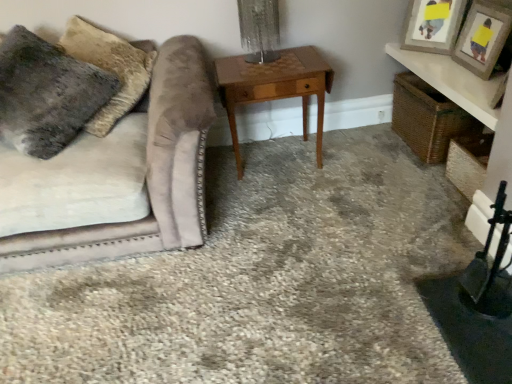
Question: Is wooden picture frame at upper right, placed as the second picture frame when sorted from back to front, closer to camera compared to wooden picture frame at upper right, which ranks as the 2th picture frame in front-to-back order?

Choices:
 (A) yes
 (B) no

Answer: (A)

Question: Is wooden picture frame at upper right, which is the 1th picture frame in front-to-back order, wider than wooden picture frame at upper right, marked as the first picture frame in a back-to-front arrangement?

Choices:
 (A) yes
 (B) no

Answer: (A)

Question: Is wooden picture frame at upper right, which is the 1th picture frame in front-to-back order, thinner than wooden picture frame at upper right, marked as the first picture frame in a back-to-front arrangement?

Choices:
 (A) yes
 (B) no

Answer: (B)

Question: Is wooden picture frame at upper right, placed as the second picture frame when sorted from back to front, with wooden picture frame at upper right, which ranks as the 2th picture frame in front-to-back order?

Choices:
 (A) no
 (B) yes

Answer: (A)

Question: Is wooden picture frame at upper right, marked as the first picture frame in a back-to-front arrangement, completely or partially inside wooden picture frame at upper right, which is the 1th picture frame in front-to-back order?

Choices:
 (A) yes
 (B) no

Answer: (B)

Question: Is wooden picture frame at upper right, which is the 1th picture frame in front-to-back order, taller than wooden picture frame at upper right, marked as the first picture frame in a back-to-front arrangement?

Choices:
 (A) no
 (B) yes

Answer: (B)

Question: Does wooden picture frame at upper right, placed as the second picture frame when sorted from back to front, have a lesser height compared to light brown wood table at center?

Choices:
 (A) no
 (B) yes

Answer: (B)

Question: Can you confirm if wooden picture frame at upper right, which is the 1th picture frame in front-to-back order, is smaller than light brown wood table at center?

Choices:
 (A) no
 (B) yes

Answer: (B)

Question: Does wooden picture frame at upper right, which is the 1th picture frame in front-to-back order, appear on the left side of light brown wood table at center?

Choices:
 (A) no
 (B) yes

Answer: (A)

Question: Is wooden picture frame at upper right, placed as the second picture frame when sorted from back to front, not near light brown wood table at center?

Choices:
 (A) no
 (B) yes

Answer: (A)

Question: Is wooden picture frame at upper right, placed as the second picture frame when sorted from back to front, outside of light brown wood table at center?

Choices:
 (A) yes
 (B) no

Answer: (A)

Question: From a real-world perspective, does wooden picture frame at upper right, which is the 1th picture frame in front-to-back order, sit lower than light brown wood table at center?

Choices:
 (A) no
 (B) yes

Answer: (A)

Question: Are fuzzy gray pillow at upper left and wooden picture frame at upper right, which is the 1th picture frame in front-to-back order, beside each other?

Choices:
 (A) yes
 (B) no

Answer: (B)